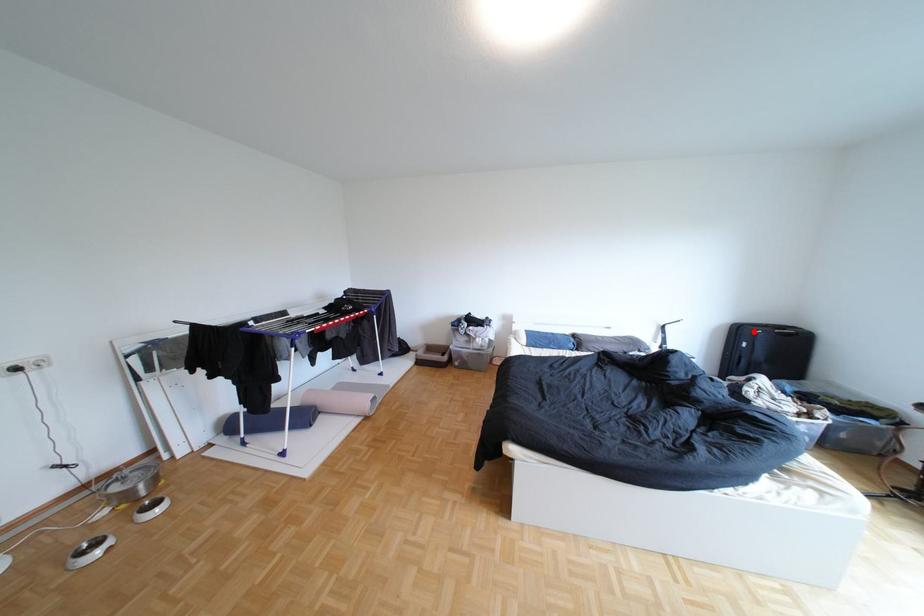
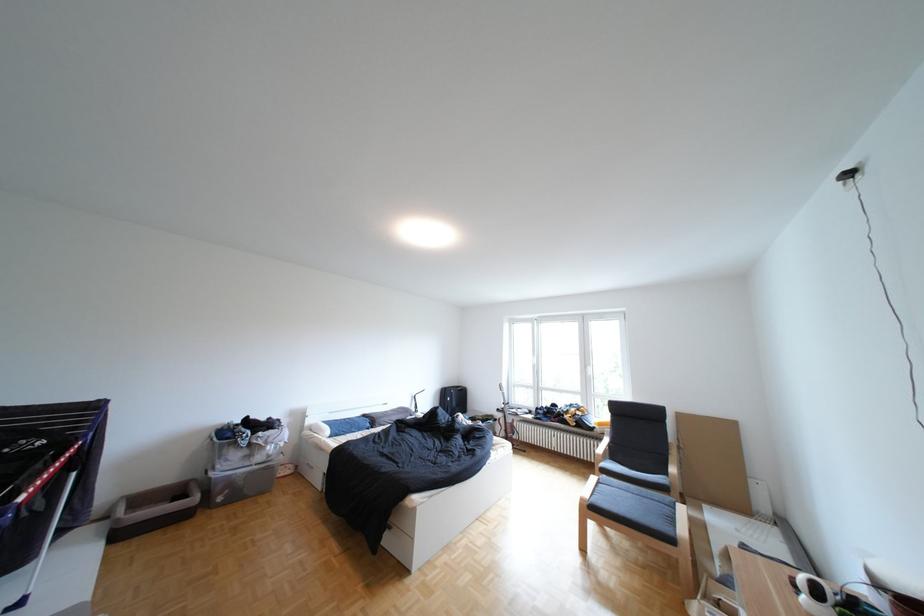
Where in the second image is the point corresponding to the highlighted location from the first image?

(459, 392)